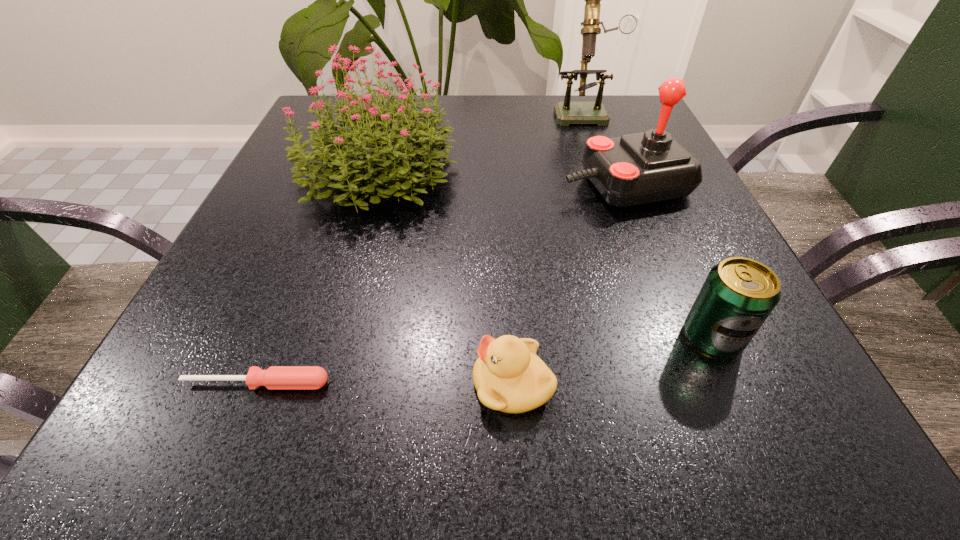
At what (x,y) coordinates should I click in order to perform the action: click on blank area in the image that satisfies the following two spatial constraints: 1. at the eyepiece of the tallest object; 2. on the front-facing side of the fifth tallest object. Please return your answer as a coordinate pair (x, y). The width and height of the screenshot is (960, 540). Looking at the image, I should click on (682, 383).

Where is `free point that satisfies the following two spatial constraints: 1. on the front side of the beer can; 2. on the front-facing side of the fifth tallest object`? This screenshot has width=960, height=540. free point that satisfies the following two spatial constraints: 1. on the front side of the beer can; 2. on the front-facing side of the fifth tallest object is located at coordinates (732, 383).

Identify the location of free space that satisfies the following two spatial constraints: 1. at the eyepiece of the fourth tallest object; 2. on the right side of the tallest object. The image size is (960, 540). (665, 338).

The width and height of the screenshot is (960, 540). Find the location of `free region that satisfies the following two spatial constraints: 1. at the eyepiece of the farthest object; 2. on the right side of the fourth tallest object`. free region that satisfies the following two spatial constraints: 1. at the eyepiece of the farthest object; 2. on the right side of the fourth tallest object is located at coordinates (665, 338).

You are a GUI agent. You are given a task and a screenshot of the screen. Output one action in this format:
    pyautogui.click(x=<x>, y=<y>)
    Task: Click on the vacant point that satisfies the following two spatial constraints: 1. on the back side of the shortest object; 2. on the right side of the joystick
    The height and width of the screenshot is (540, 960).
    Given the screenshot: What is the action you would take?
    pyautogui.click(x=335, y=185)

At what (x,y) coordinates should I click in order to perform the action: click on vacant space that satisfies the following two spatial constraints: 1. at the eyepiece of the microscope; 2. on the right side of the beer can. Please return your answer as a coordinate pair (x, y). This screenshot has width=960, height=540. Looking at the image, I should click on coord(665,338).